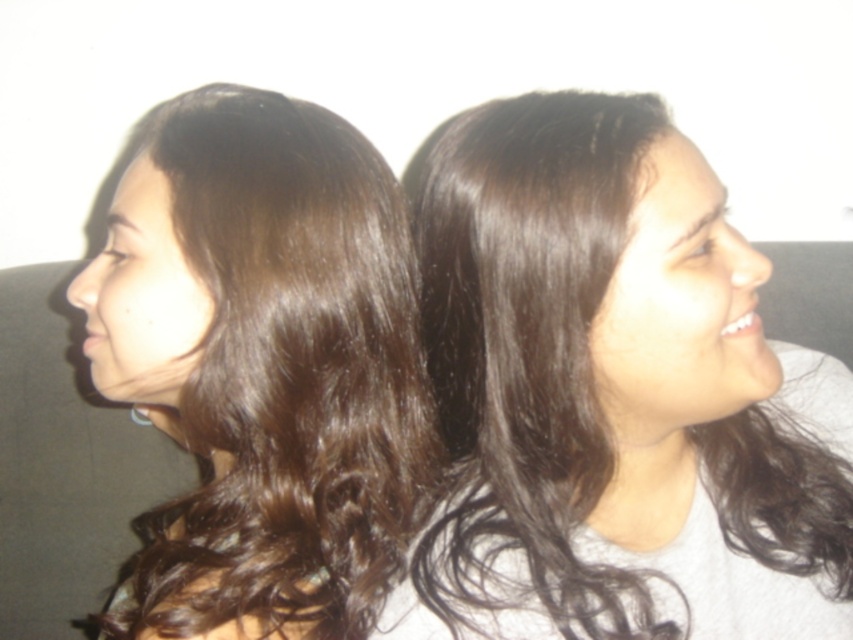
You are a photographer trying to capture a candid shot of two people with dark brown hair. You notice dark brown hair at center and dark brown hair at left in the frame. Which dark brown hair is located to the right of the other?

The dark brown hair at center is positioned on the right side of dark brown hair at left.

You are a photographer adjusting your camera to focus on two points in the image. The points are labeled as point (639,116) and point (306,518). Which point is nearer to you?

Point (639,116) is closer to the viewer than point (306,518).

You are an AI analyzing the image. The scene has two people with dark brown hair at center. What are their exact coordinates?

The dark brown hair at center is located at coordinates (614, 396).